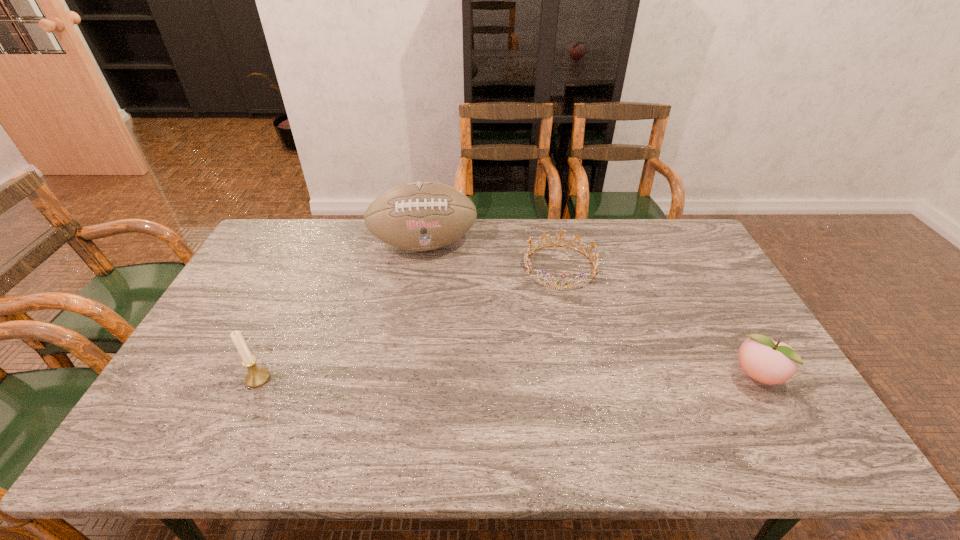
What are the coordinates of `object that is at the right edge` in the screenshot? It's located at (761, 358).

Identify the location of object that is positioned at the near right corner. (761, 358).

Identify the location of blank area at the far edge. This screenshot has width=960, height=540. (326, 233).

Find the location of a particular element. The width and height of the screenshot is (960, 540). free space at the near edge is located at coordinates pos(638,403).

This screenshot has height=540, width=960. Identify the location of vacant space at the left edge. (211, 335).

I want to click on vacant region at the right edge of the desktop, so click(690, 264).

Identify the location of vacant space at the far left corner of the desktop. (300, 230).

Identify the location of vacant space at the far right corner of the desktop. (671, 239).

Identify the location of free space between the tallest object and the candle holder. The width and height of the screenshot is (960, 540). (341, 311).

Locate an element on the screen. This screenshot has height=540, width=960. free space between the shortest object and the candle holder is located at coordinates (409, 322).